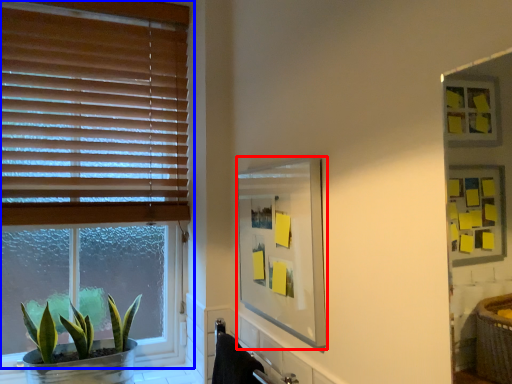
Question: Which point is further to the camera, mirror (highlighted by a red box) or window (highlighted by a blue box)?

Choices:
 (A) mirror
 (B) window

Answer: (B)